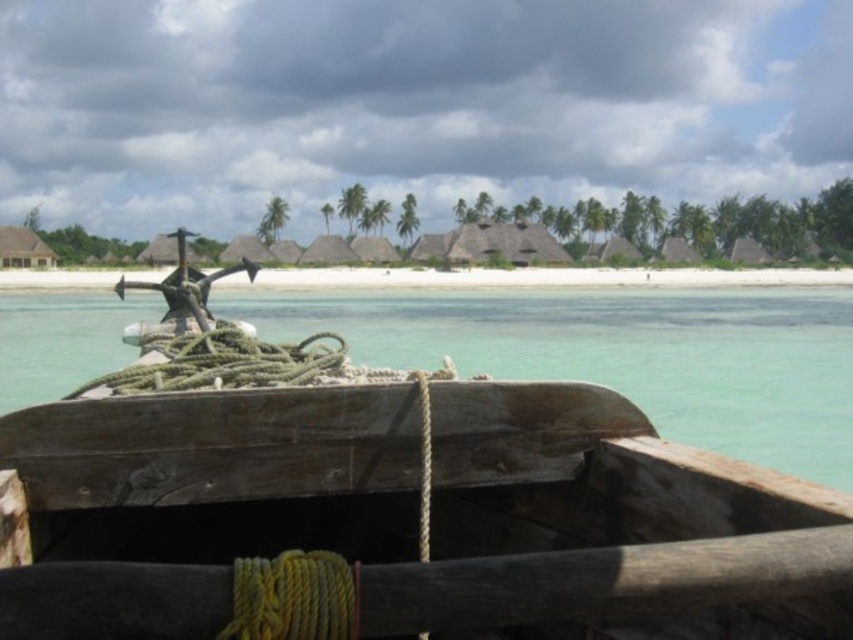
You are an observer in the wooden boat at center. You want to reach the white sand beach at center. Which direction should you move to get closer to the beach?

The wooden boat at center is positioned on the left side of white sand beach at center, so you should move to the right to get closer to the white sand beach at center.

You are on a wooden boat at center and want to swim to the white sand beach at center. The average swimming speed of a person is 2 meters per second. How many minutes will it take you to reach the beach?

The wooden boat at center and white sand beach at center are 156.09 meters apart. At a swimming speed of 2 meters per second, it would take 156.09 divided by 2 equals 78.045 seconds. Converting seconds to minutes, 78.045 divided by 60 equals approximately 1.3 minutes. Therefore, it would take about 1.3 minutes to swim from the wooden boat at center to the white sand beach at center.

You are navigating a wooden boat at center and want to dock it on the white sand beach at center. Based on their widths, will the boat fit entirely on the beach?

The wooden boat at center has a lesser width compared to white sand beach at center, so the boat will fit entirely on the beach since it is narrower than the beach.